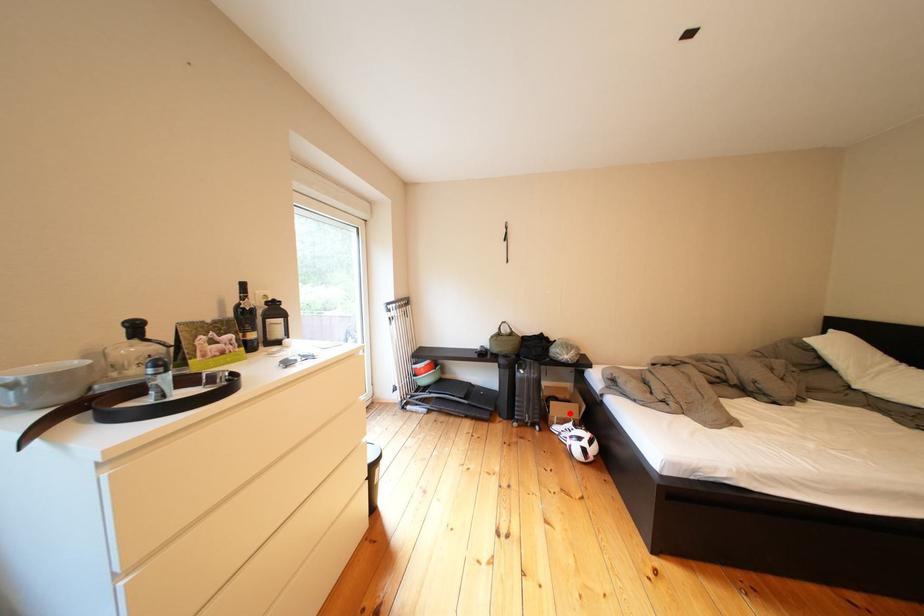
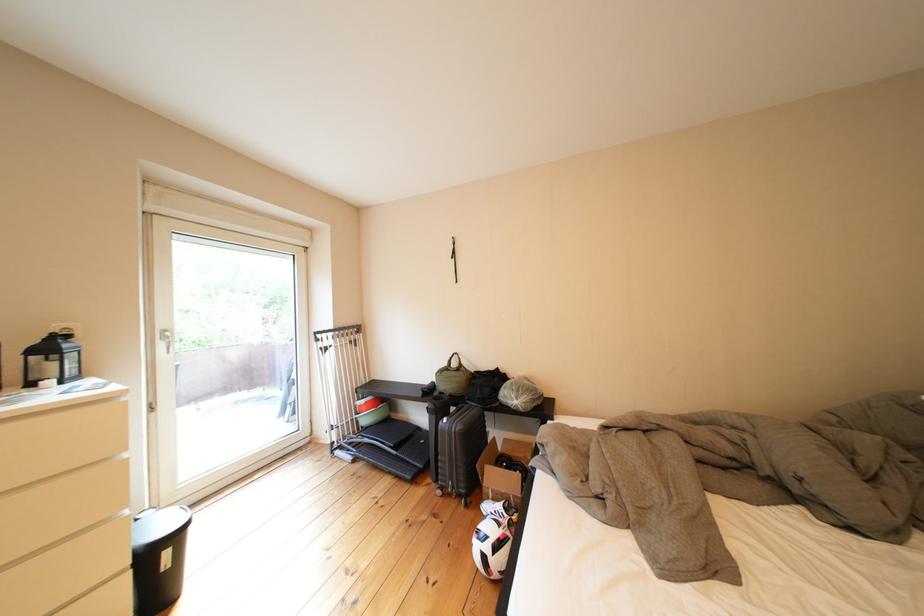
Question: I am providing you with two images of the same scene from different viewpoints. Given a red point in image1, look at the same physical point in image2. Is it:

Choices:
 (A) Closer to the viewpoint
 (B) Farther from the viewpoint

Answer: (A)